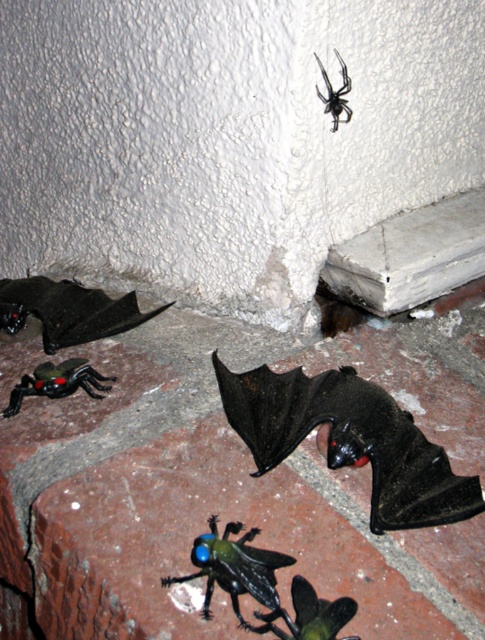
Does black matte bat at lower center appear on the left side of black matte spider at upper center?

Indeed, black matte bat at lower center is positioned on the left side of black matte spider at upper center.

Can you confirm if black matte bat at lower center is bigger than black matte spider at upper center?

Correct, black matte bat at lower center is larger in size than black matte spider at upper center.

Identify the location of black matte bat at lower center. (350, 440).

Where is `matte black bat at lower left`? The height and width of the screenshot is (640, 485). matte black bat at lower left is located at coordinates [67, 310].

How much distance is there between matte black bat at lower left and glossy plastic spider at lower left?

5.24 inches

Does point (133, 300) come behind point (12, 403)?

That is True.

Locate an element on the screen. The image size is (485, 640). matte black bat at lower left is located at coordinates (67, 310).

Can you confirm if black matte bat at lower center is positioned to the right of green glossy beetle at lower center?

Indeed, black matte bat at lower center is positioned on the right side of green glossy beetle at lower center.

Is black matte bat at lower center in front of green glossy beetle at lower center?

No, it is behind green glossy beetle at lower center.

Does point (387, 465) come farther from viewer compared to point (264, 627)?

Yes, it is.

At what (x,y) coordinates should I click in order to perform the action: click on black matte bat at lower center. Please return your answer as a coordinate pair (x, y). Looking at the image, I should click on (350, 440).